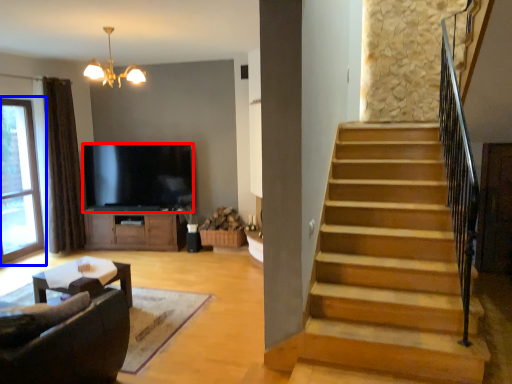
Question: Which object appears farthest to the camera in this image, television (highlighted by a red box) or window (highlighted by a blue box)?

Choices:
 (A) television
 (B) window

Answer: (A)